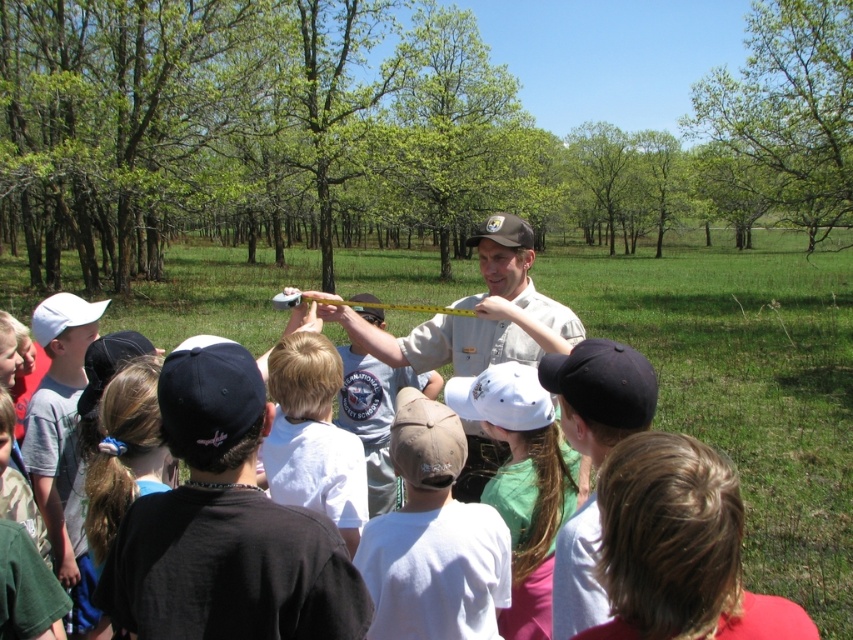
You are a photographer trying to capture a clear photo of the green cotton shirt at center and the light brown cotton shirt at center. Which one would be easier to focus on due to its position?

The green cotton shirt at center is in front of the light brown cotton shirt at center, so it would be easier to focus on the green cotton shirt at center because it is closer to the camera.

You are a photographer standing at the back of the group. You want to take a photo that includes both the green cotton shirt at center and the white matte baseball cap at left. Which object should you adjust your focus on first to ensure both are in the frame?

The green cotton shirt at center is closer to the viewer than the white matte baseball cap at left, so you should focus on the green cotton shirt at center first to ensure both are in the frame.